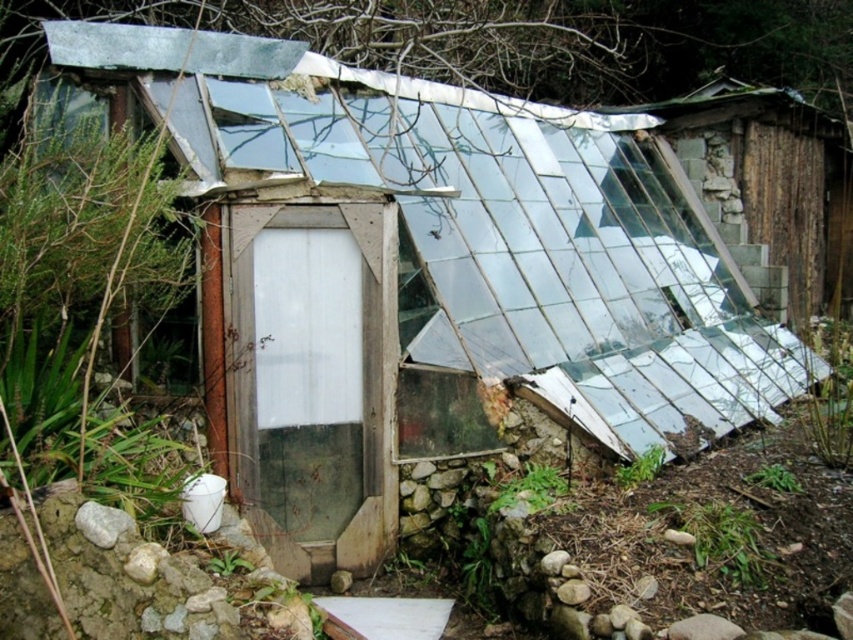
Between transparent glass hut at right and gray rock at lower left, which one appears on the left side from the viewer's perspective?

Positioned to the left is gray rock at lower left.

Measure the distance between point (811, 292) and camera.

Point (811, 292) and camera are 10.64 meters apart from each other.

Identify the location of transparent glass hut at right. The height and width of the screenshot is (640, 853). tap(769, 186).